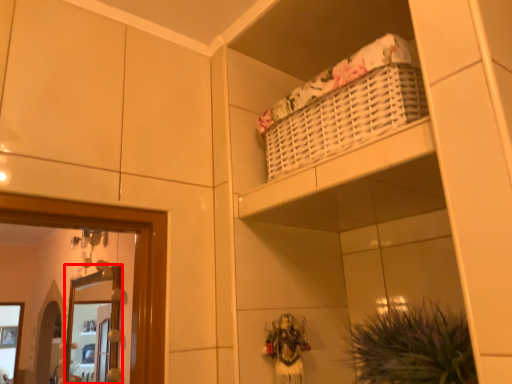
Question: From the image's perspective, where is mirror (annotated by the red box) located relative to plant?

Choices:
 (A) above
 (B) below

Answer: (B)